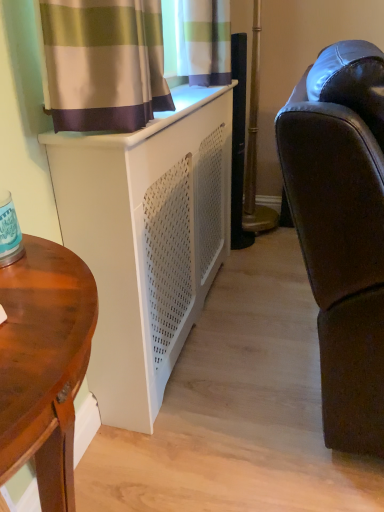
Question: Based on their sizes in the image, would you say matte black leather couch at right is bigger or smaller than wooden desk at left?

Choices:
 (A) small
 (B) big

Answer: (B)

Question: Considering the relative positions of matte black leather couch at right and wooden desk at left in the image provided, is matte black leather couch at right to the left or to the right of wooden desk at left?

Choices:
 (A) right
 (B) left

Answer: (A)

Question: Considering the real-world distances, which object is closest to the wooden desk at left?

Choices:
 (A) white matte cabinet at lower left
 (B) matte black leather couch at right

Answer: (A)

Question: Which object is positioned farthest from the wooden desk at left?

Choices:
 (A) matte black leather couch at right
 (B) white matte cabinet at lower left

Answer: (A)